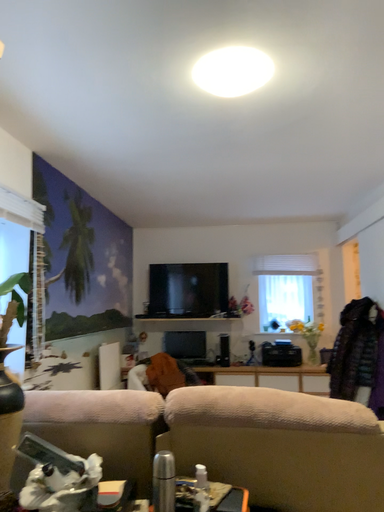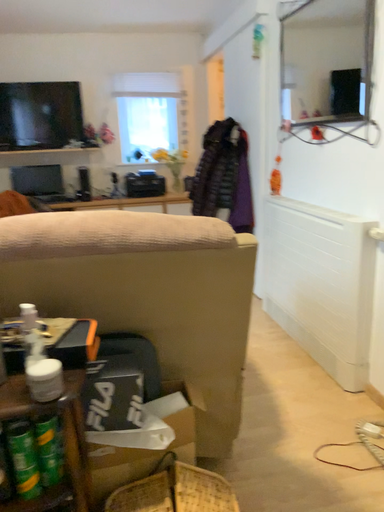
Question: How did the camera likely rotate when shooting the video?

Choices:
 (A) rotated right
 (B) rotated left

Answer: (A)